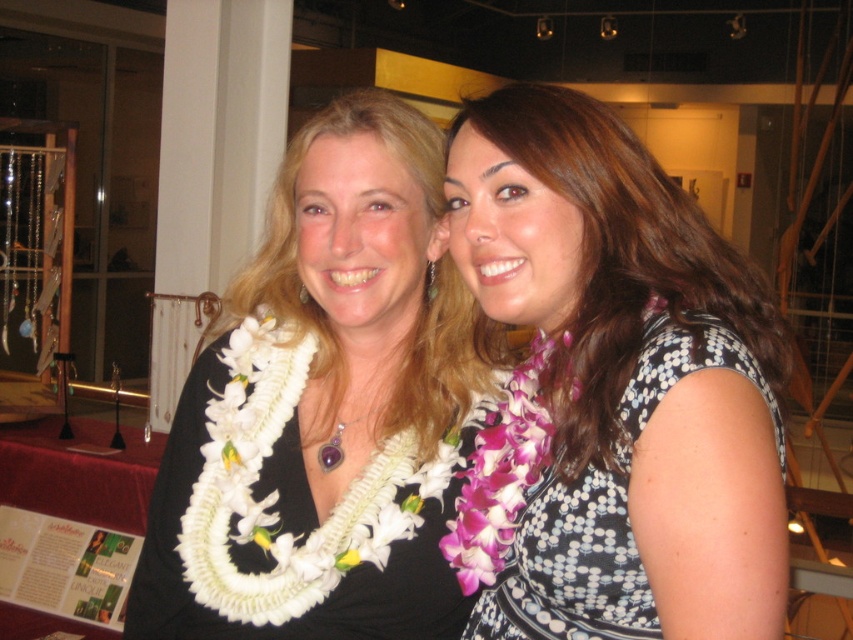
Question: Which point is closer to the camera taking this photo?

Choices:
 (A) (340, 433)
 (B) (694, 337)
 (C) (288, 392)
 (D) (659, 342)

Answer: (B)

Question: Does purple floral lei at right come behind purple gemstone pendant at center?

Choices:
 (A) yes
 (B) no

Answer: (B)

Question: Is white dotted fabric dress at center behind purple gemstone pendant at center?

Choices:
 (A) yes
 (B) no

Answer: (B)

Question: Which object appears closest to the camera in this image?

Choices:
 (A) purple floral lei at right
 (B) white dotted fabric dress at center

Answer: (B)

Question: Which point is closer to the camera?

Choices:
 (A) purple flower lei at center
 (B) purple floral lei at right
 (C) white fabric lei at center
 (D) white dotted fabric dress at center

Answer: (D)

Question: Does purple floral lei at right come behind purple gemstone pendant at center?

Choices:
 (A) no
 (B) yes

Answer: (A)